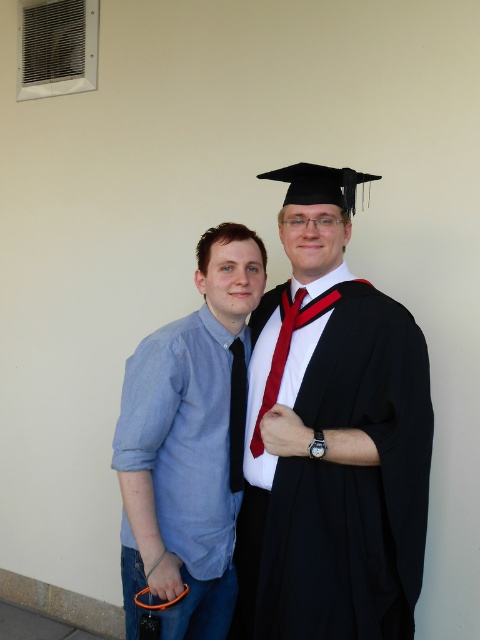
You are an event photographer at a graduation ceremony. You need to capture a photo where both the matte black graduation gown at center and the shiny silk tie at center are clearly visible. Based on their heights, which object should you focus on first to ensure proper exposure?

The matte black graduation gown at center is taller than the shiny silk tie at center, so you should focus on the matte black graduation gown at center first to ensure proper exposure.